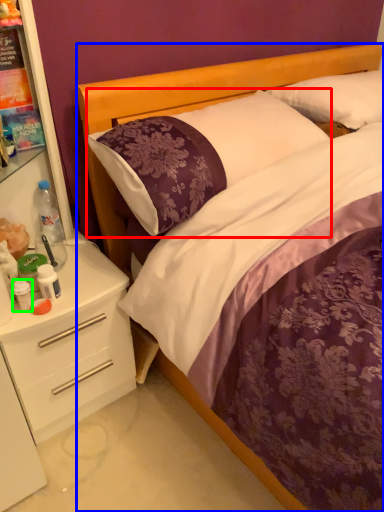
Question: Considering the real-world distances, which object is farthest from pillow (highlighted by a red box)? bed (highlighted by a blue box) or bottle (highlighted by a green box)?

Choices:
 (A) bed
 (B) bottle

Answer: (B)